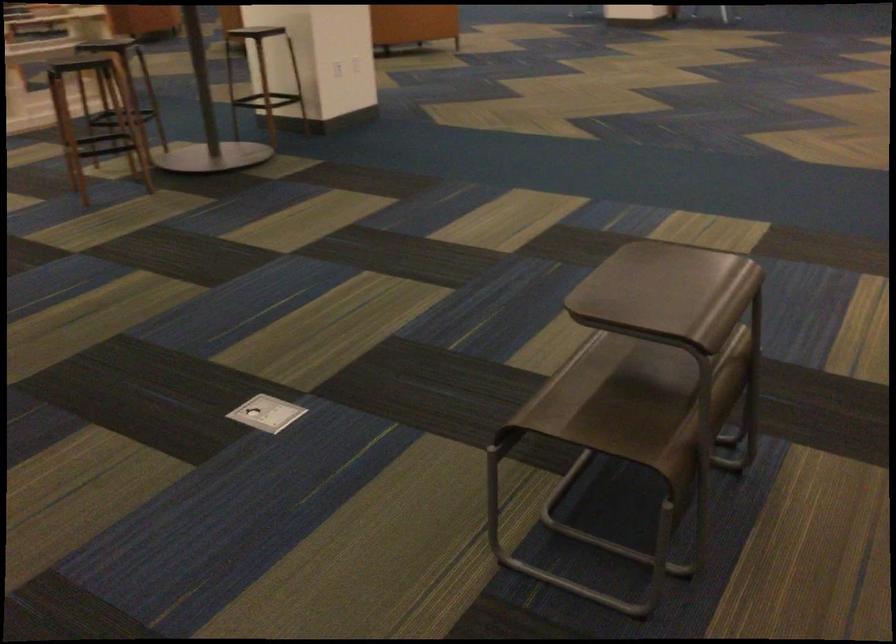
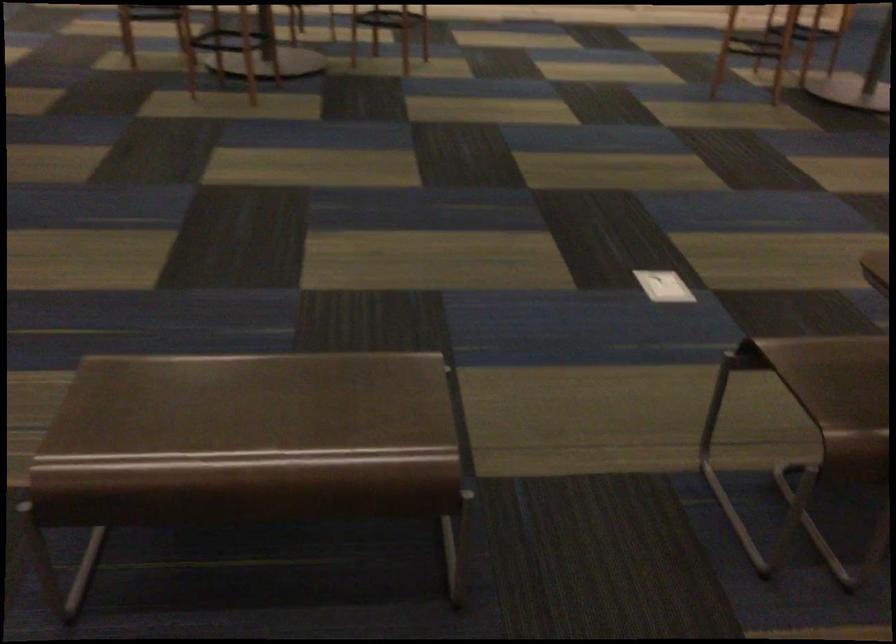
The point at (x=277, y=418) is marked in the first image. Where is the corresponding point in the second image?

(664, 286)